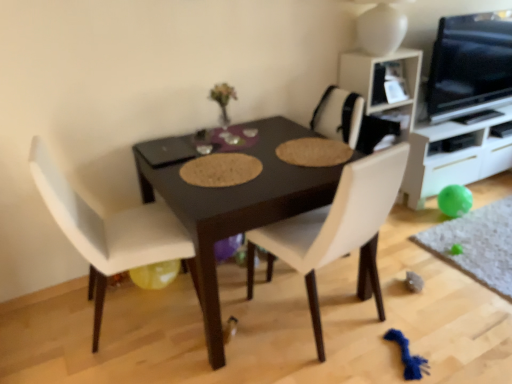
Where is `vacant space to the right of yellow rubber balloon at lower left`? This screenshot has height=384, width=512. vacant space to the right of yellow rubber balloon at lower left is located at coordinates (182, 297).